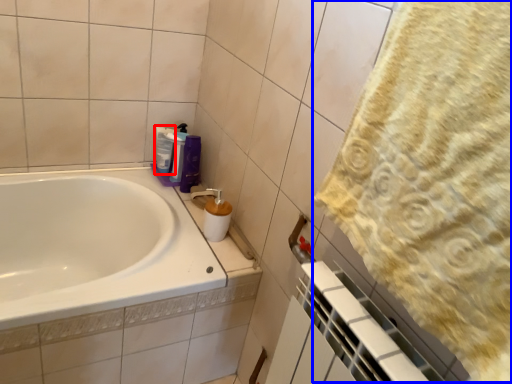
Question: Among these objects, which one is farthest to the camera, cleaning product (highlighted by a red box) or bath towel (highlighted by a blue box)?

Choices:
 (A) cleaning product
 (B) bath towel

Answer: (A)